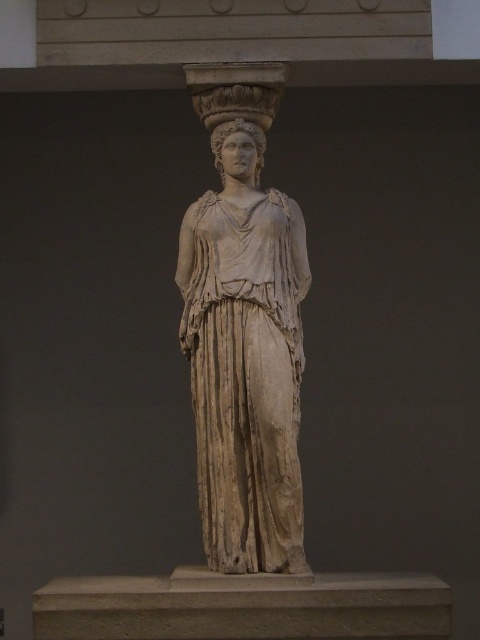
Is beige stone statue at center bigger than smooth white head at center?

Correct, beige stone statue at center is larger in size than smooth white head at center.

Is beige stone statue at center wider than smooth white head at center?

Yes.

I want to click on beige stone statue at center, so click(244, 358).